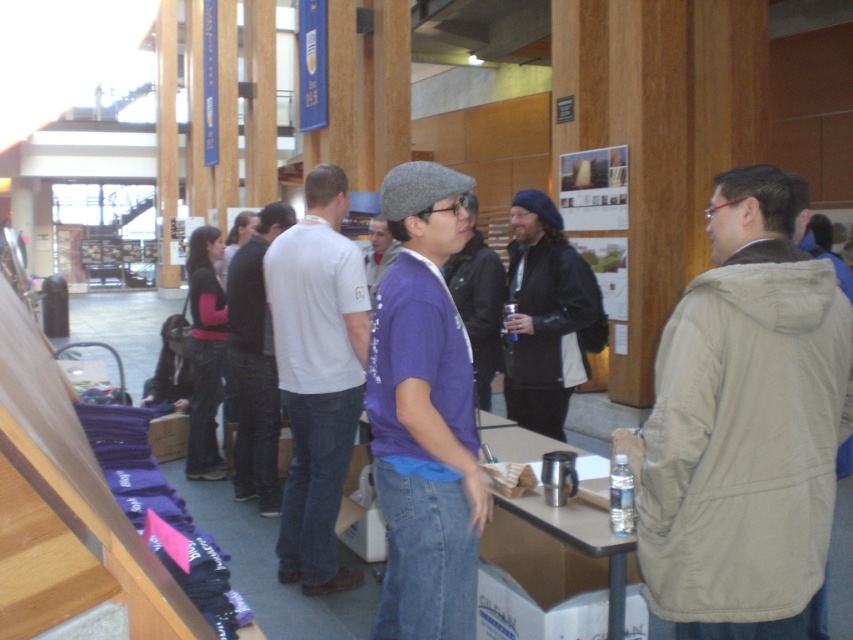
Looking at this image, is white cotton t-shirt at center to the right of purple matte shirt at center from the viewer's perspective?

No, white cotton t-shirt at center is not to the right of purple matte shirt at center.

Where is `white cotton t-shirt at center`? This screenshot has height=640, width=853. white cotton t-shirt at center is located at coordinates pyautogui.click(x=317, y=376).

Is tan fabric jacket at right below matte purple t-shirt at center?

Actually, tan fabric jacket at right is above matte purple t-shirt at center.

Does tan fabric jacket at right have a greater width compared to matte purple t-shirt at center?

Yes.

Between point (727, 241) and point (376, 467), which one is positioned behind?

The point (376, 467) is behind.

At what (x,y) coordinates should I click in order to perform the action: click on tan fabric jacket at right. Please return your answer as a coordinate pair (x, y). The image size is (853, 640). Looking at the image, I should click on (746, 426).

Is tan fabric jacket at right closer to the viewer compared to black leather jacket at center?

Yes, tan fabric jacket at right is in front of black leather jacket at center.

Is point (711, 600) farther from viewer compared to point (526, 225)?

That is False.

The width and height of the screenshot is (853, 640). What do you see at coordinates (746, 426) in the screenshot?
I see `tan fabric jacket at right` at bounding box center [746, 426].

The image size is (853, 640). I want to click on tan fabric jacket at right, so click(746, 426).